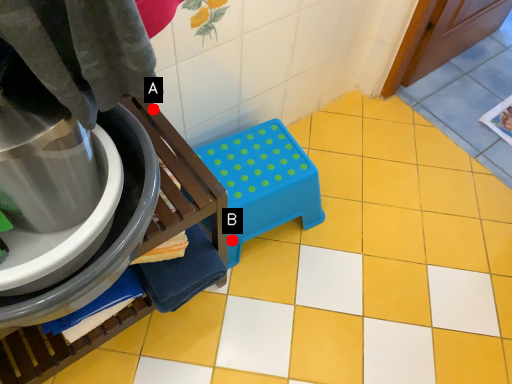
Question: Two points are circled on the image, labeled by A and B beside each circle. Which point is farther from the camera taking this photo?

Choices:
 (A) A is further
 (B) B is further

Answer: (B)